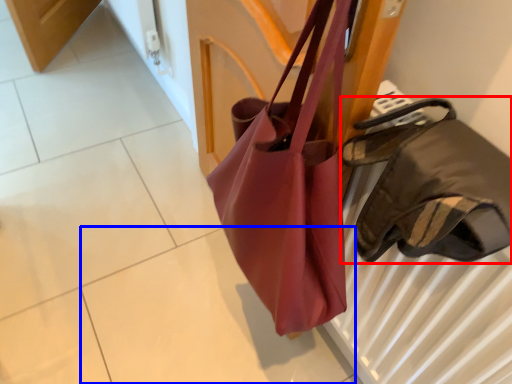
Question: Which of the following is the closest to the observer, handbag (highlighted by a red box) or tile (highlighted by a blue box)?

Choices:
 (A) handbag
 (B) tile

Answer: (A)